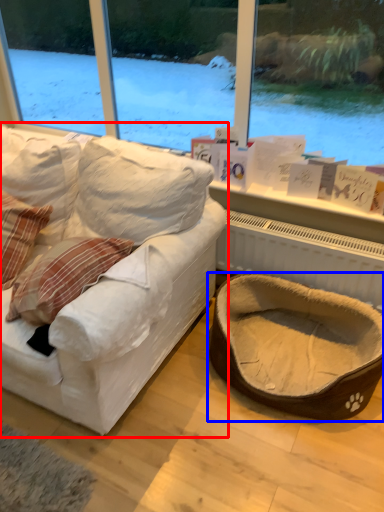
Question: Which object appears farthest to the camera in this image, studio couch (highlighted by a red box) or dog bed (highlighted by a blue box)?

Choices:
 (A) studio couch
 (B) dog bed

Answer: (B)